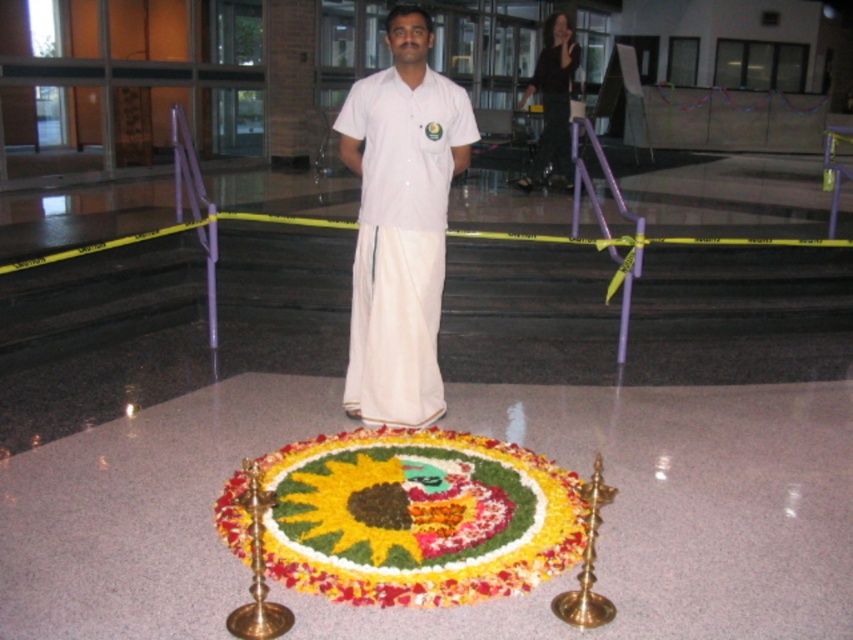
From the picture: Which is below, white cotton kurta at center or black silk robe at upper center?

Positioned lower is white cotton kurta at center.

Can you confirm if white cotton kurta at center is thinner than black silk robe at upper center?

In fact, white cotton kurta at center might be wider than black silk robe at upper center.

At what (x,y) coordinates should I click in order to perform the action: click on white cotton kurta at center. Please return your answer as a coordinate pair (x, y). This screenshot has width=853, height=640. Looking at the image, I should click on (399, 224).

Locate an element on the screen. This screenshot has height=640, width=853. white cotton kurta at center is located at coordinates (399, 224).

Can you confirm if floral carpet at center is wider than white cotton kurta at center?

Yes, floral carpet at center is wider than white cotton kurta at center.

Does floral carpet at center have a greater height compared to white cotton kurta at center?

In fact, floral carpet at center may be shorter than white cotton kurta at center.

Find the location of a particular element. floral carpet at center is located at coordinates (416, 516).

Who is positioned more to the right, floral carpet at center or black silk robe at upper center?

black silk robe at upper center

Which of these two, floral carpet at center or black silk robe at upper center, stands taller?

black silk robe at upper center is taller.

Is point (297, 452) positioned behind point (567, 177)?

That is False.

I want to click on floral carpet at center, so click(x=416, y=516).